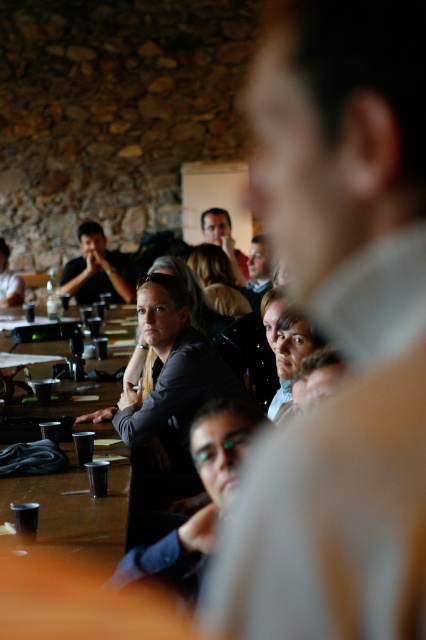
Is brown wooden table at lower left thinner than matte black shirt at center?

Yes, brown wooden table at lower left is thinner than matte black shirt at center.

Who is positioned more to the right, brown wooden table at lower left or matte black shirt at center?

brown wooden table at lower left is more to the right.

The height and width of the screenshot is (640, 426). What do you see at coordinates (75, 508) in the screenshot? I see `brown wooden table at lower left` at bounding box center [75, 508].

Identify the location of brown wooden table at lower left. click(75, 508).